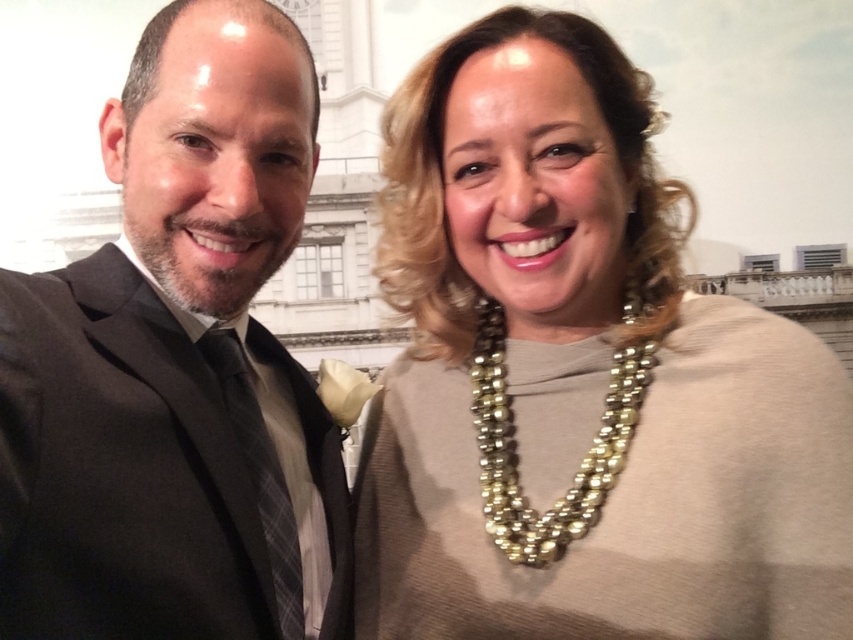
You are a photographer trying to adjust the lighting for a photo shoot. You notice the matte gold necklace at center and the black satin suit at left. Which object requires more focused lighting to highlight its details?

The matte gold necklace at center requires more focused lighting because it is bigger than the black satin suit at left, making it a more prominent feature to highlight.

You are taking a photo of two people standing in front of a classical building backdrop. The man is on the left wearing a dark suit, and the woman is on the right wearing a light gray top. There is a point at coordinates (579, 378). What object is located at that point?

The point at coordinates (579, 378) marks the matte gold necklace at center.